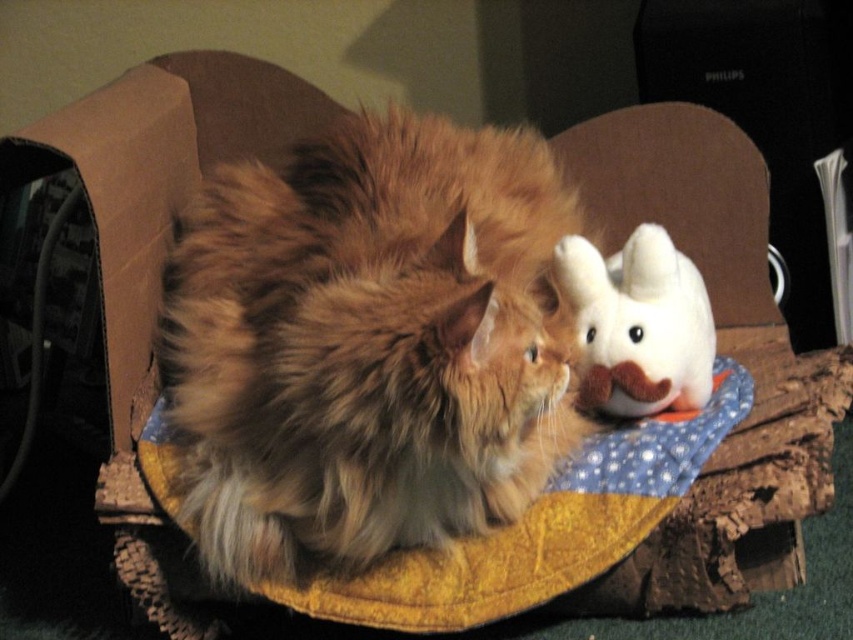
Is fuzzy brown cat at center to the left of white plush toy at upper right from the viewer's perspective?

Correct, you'll find fuzzy brown cat at center to the left of white plush toy at upper right.

Is point (178, 275) farther from camera compared to point (618, 406)?

Yes, point (178, 275) is farther from viewer.

Where is `fuzzy brown cat at center`? The width and height of the screenshot is (853, 640). fuzzy brown cat at center is located at coordinates (367, 344).